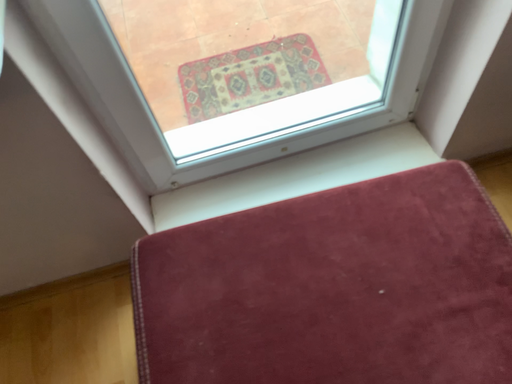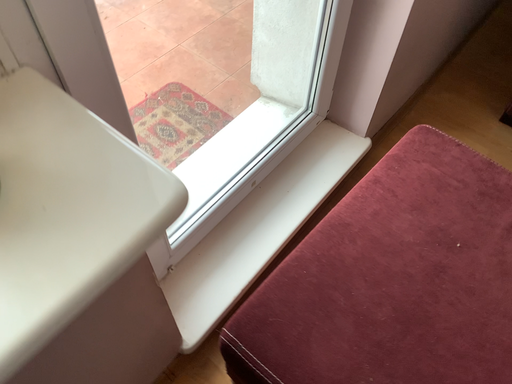
Question: How did the camera likely rotate when shooting the video?

Choices:
 (A) rotated right
 (B) rotated left

Answer: (A)